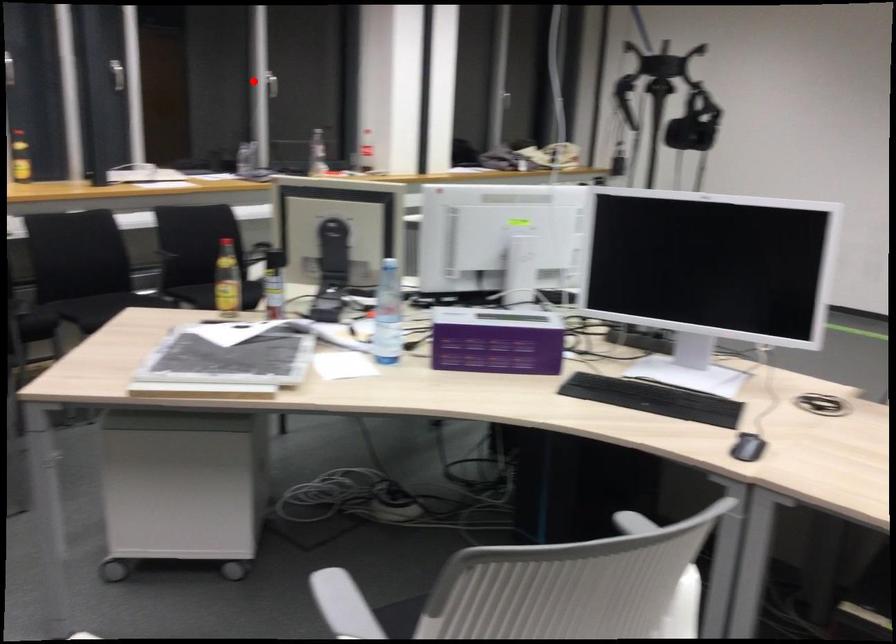
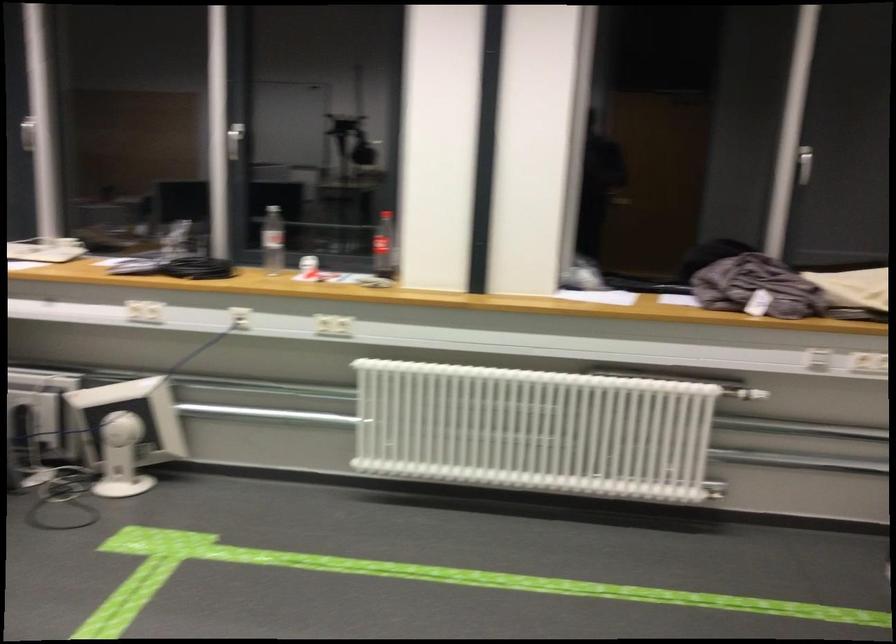
Where in the second image is the point corresponding to the highlighted location from the first image?

(235, 140)